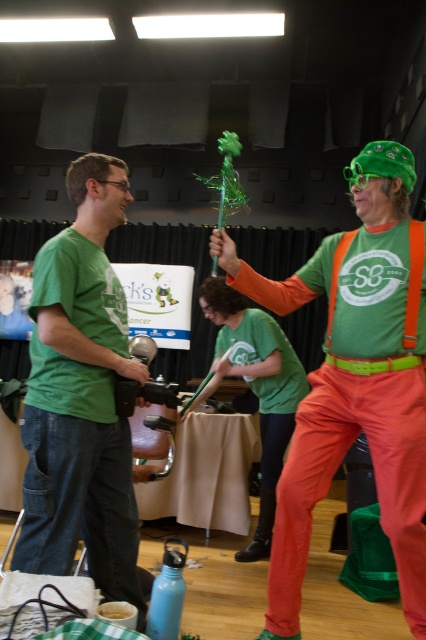
Question: Does matte green t-shirt at center have a smaller size compared to green matte t-shirt at center?

Choices:
 (A) no
 (B) yes

Answer: (B)

Question: Does matte green t-shirt at center have a larger size compared to green matte t-shirt at center?

Choices:
 (A) yes
 (B) no

Answer: (B)

Question: Observing the image, what is the correct spatial positioning of matte green t-shirt at center in reference to green matte t-shirt at center?

Choices:
 (A) right
 (B) left

Answer: (A)

Question: Which point appears closest to the camera in this image?

Choices:
 (A) (92, 486)
 (B) (399, 525)

Answer: (B)

Question: Which point is farther from the camera taking this photo?

Choices:
 (A) (134, 561)
 (B) (216, 339)
 (C) (354, 356)

Answer: (B)

Question: Which point is farther to the camera?

Choices:
 (A) (287, 532)
 (B) (31, 419)

Answer: (A)